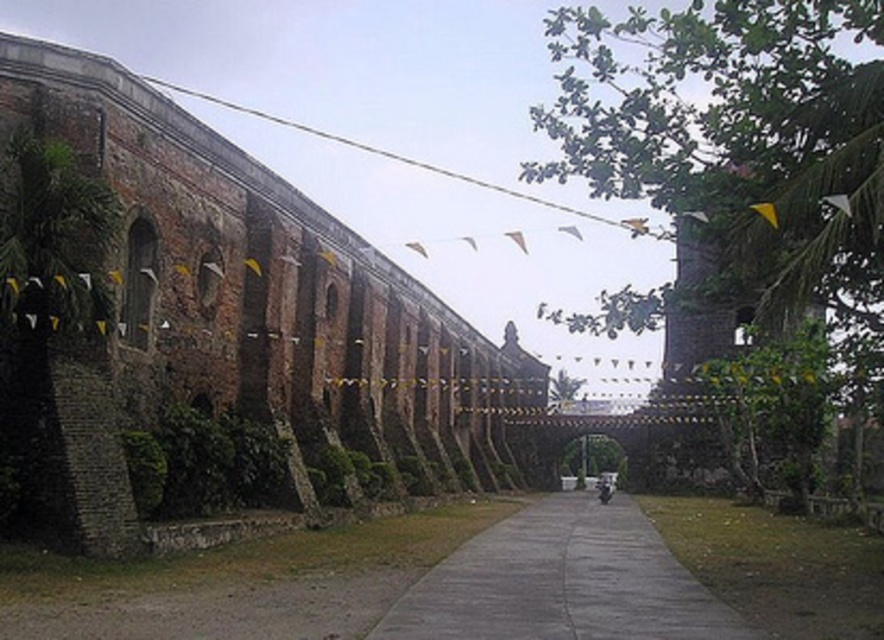
Question: Among these objects, which one is farthest from the camera?

Choices:
 (A) gray concrete pavement at center
 (B) green leafy tree at center
 (C) brown brick wall at left

Answer: (B)

Question: Which object is closer to the camera taking this photo?

Choices:
 (A) brick wall at upper left
 (B) green leafy tree at center
 (C) green leafy tree at upper right

Answer: (C)

Question: Can you confirm if brick wall at upper left is positioned below green leafy tree at center?

Choices:
 (A) no
 (B) yes

Answer: (A)

Question: Is gray concrete pavement at center behind silver metallic motorcycle at center?

Choices:
 (A) no
 (B) yes

Answer: (A)

Question: Which point is farther to the camera?

Choices:
 (A) click(x=575, y=109)
 (B) click(x=561, y=509)
 (C) click(x=615, y=476)
 (D) click(x=601, y=218)

Answer: (D)

Question: Is green leafy tree at upper right closer to camera compared to gray concrete pavement at center?

Choices:
 (A) no
 (B) yes

Answer: (A)